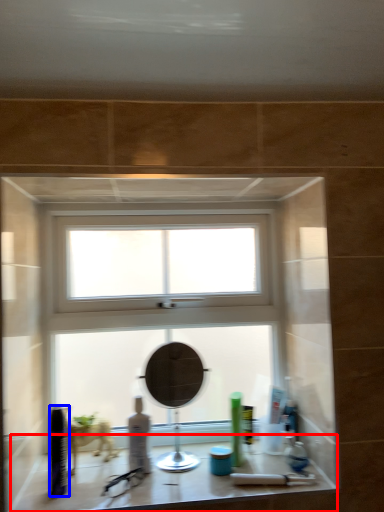
Question: Which object appears closest to the camera in this image, counter top (highlighted by a red box) or toiletry (highlighted by a blue box)?

Choices:
 (A) counter top
 (B) toiletry

Answer: (A)